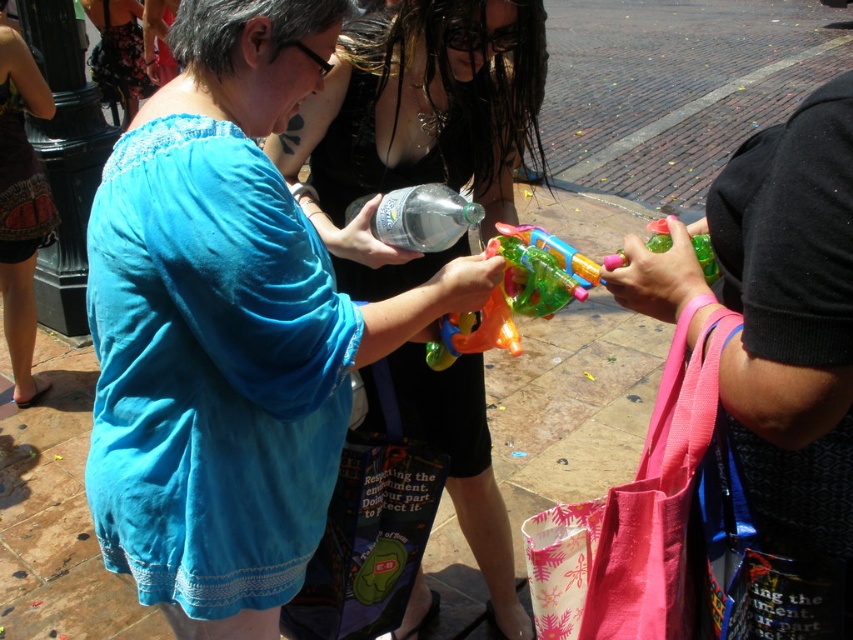
You are a photographer trying to capture the festive atmosphere of the scene. You notice the matte blue shirt at center and the pink fabric bag at right. Which object should you focus on if you want to highlight something that is bigger in size?

The matte blue shirt at center is larger in size compared to the pink fabric bag at right, so focusing on the matte blue shirt at center would highlight the bigger object.

You are a photographer trying to capture the vibrant colors of the pink fabric bag at right and the translucent plastic water gun at center in a single shot. Since you want both items to be clearly visible, which object should you focus on first to ensure proper exposure, considering their sizes?

The pink fabric bag at right is larger in width than the translucent plastic water gun at center, so focusing on the larger pink fabric bag at right first would help ensure proper exposure for both objects.